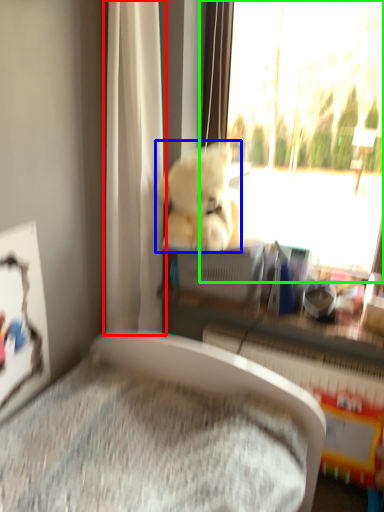
Question: Which object is positioned closest to curtain (highlighted by a red box)? Select from teddy bear (highlighted by a blue box) and window (highlighted by a green box).

Choices:
 (A) teddy bear
 (B) window

Answer: (A)